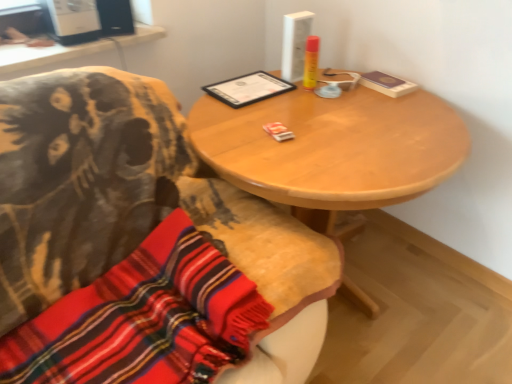
What are the coordinates of `vacant point above wooden table at center (from a real-world perspective)` in the screenshot? It's located at (326, 121).